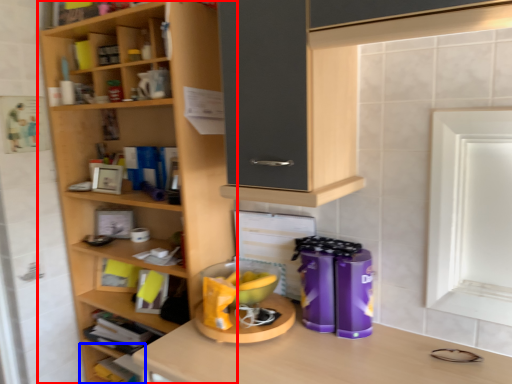
Question: Among these objects, which one is nearest to the camera, shelf (highlighted by a red box) or shelf (highlighted by a blue box)?

Choices:
 (A) shelf
 (B) shelf

Answer: (A)